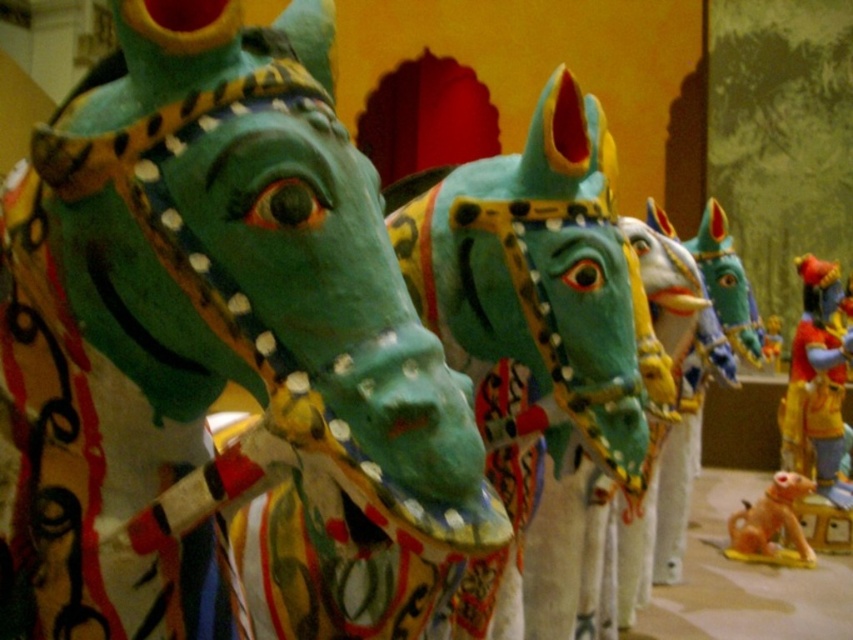
Question: Considering the real-world distances, which object is closest to the matte green horse at center?

Choices:
 (A) orange matte dog at lower right
 (B) shiny red and gold figure at right

Answer: (A)

Question: Is matte green horse at center further to camera compared to orange matte dog at lower right?

Choices:
 (A) yes
 (B) no

Answer: (B)

Question: Based on their relative distances, which object is nearer to the shiny red and gold figure at right?

Choices:
 (A) orange matte dog at lower right
 (B) matte green horse at center

Answer: (A)

Question: Which of these objects is positioned closest to the matte green horse at center?

Choices:
 (A) orange matte dog at lower right
 (B) shiny red and gold figure at right

Answer: (A)

Question: Is matte green horse at center closer to the viewer compared to orange matte dog at lower right?

Choices:
 (A) yes
 (B) no

Answer: (A)

Question: Does shiny red and gold figure at right appear on the left side of orange matte dog at lower right?

Choices:
 (A) no
 (B) yes

Answer: (A)